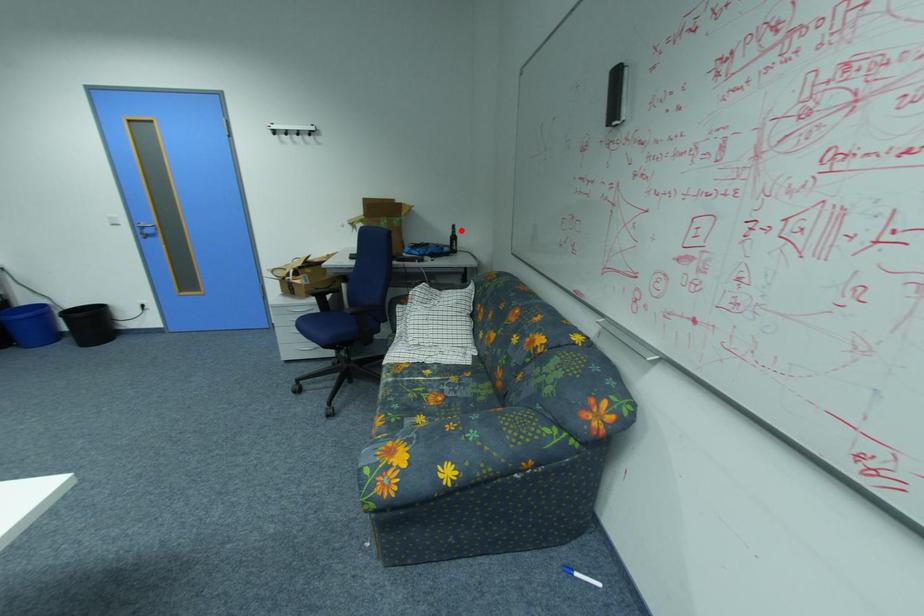
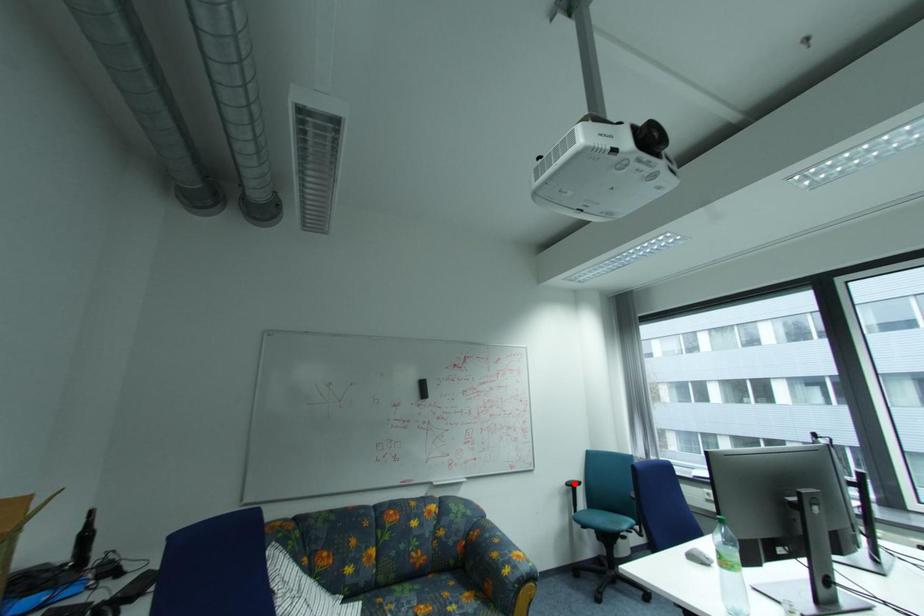
I am providing you with two images of the same scene from different viewpoints. A red point is marked on the first image and another point is marked on the second image. Does the point marked in image1 correspond to the same location as the one in image2?

No